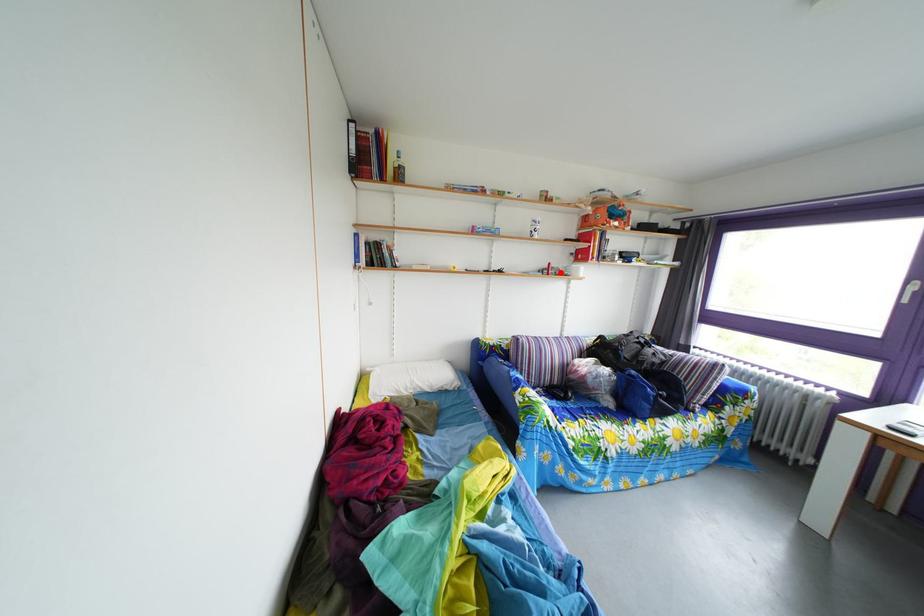
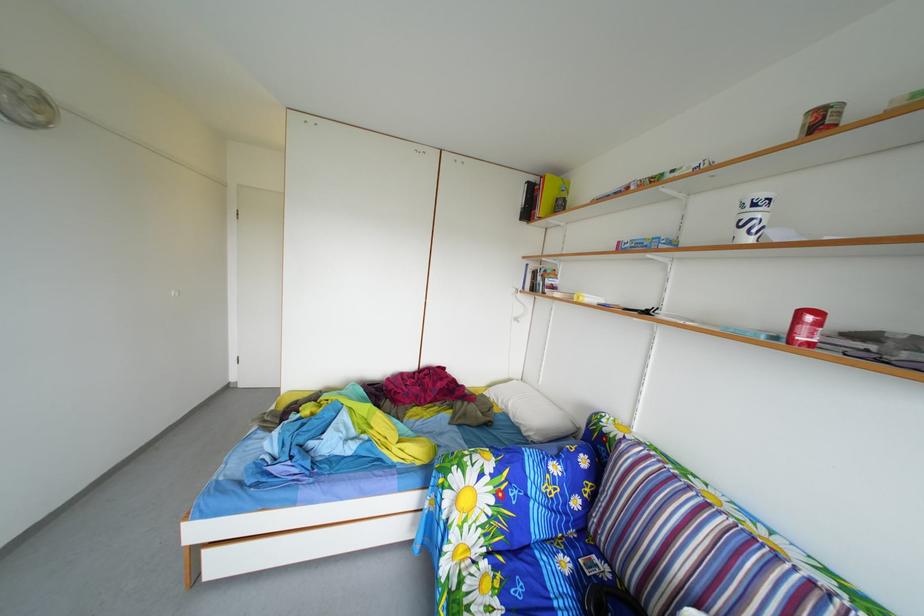
In the second image, find the point that corresponds to the highlighted location in the first image.

(811, 321)